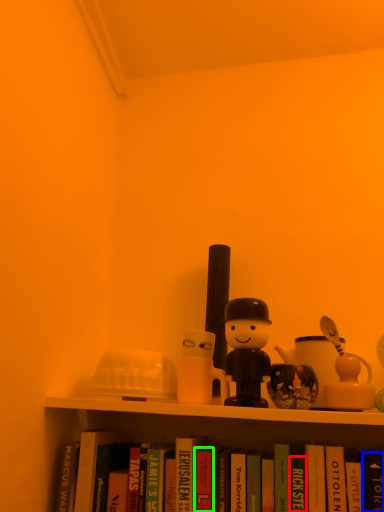
Question: Considering the real-world distances, which object is closest to paperback book (highlighted by a red box)? paperback book (highlighted by a blue box) or paperback book (highlighted by a green box).

Choices:
 (A) paperback book
 (B) paperback book

Answer: (A)